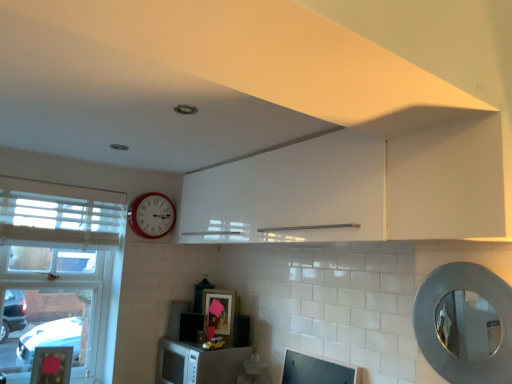
Where is `vacant region above matte black monitor at lower center (from a real-world perspective)`? vacant region above matte black monitor at lower center (from a real-world perspective) is located at coordinates (316, 344).